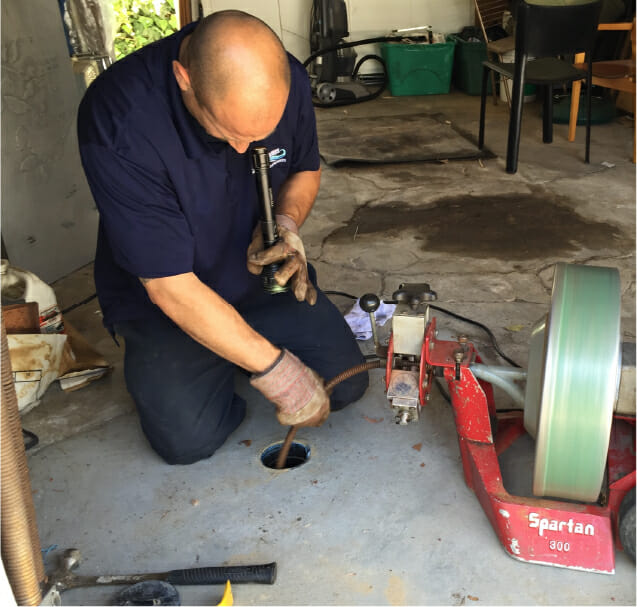
Identify the location of wall to the left of the man (his perspective. (390, 15).